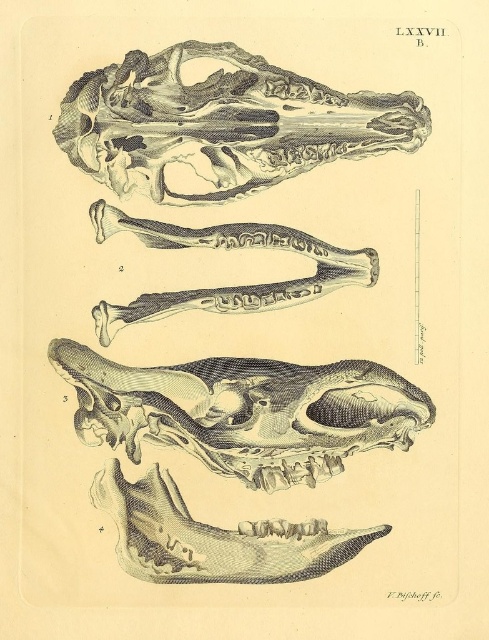
Is etched bone skull at upper center thinner than gray textured skull at center?

Correct, etched bone skull at upper center's width is less than gray textured skull at center's.

Is point (120, 140) positioned before point (274, 538)?

Yes, point (120, 140) is in front of point (274, 538).

Locate an element on the screen. This screenshot has width=489, height=640. etched bone skull at upper center is located at coordinates (222, 124).

Can you confirm if gray textured skull at center is positioned to the left of gray etched skull at upper center?

Correct, you'll find gray textured skull at center to the left of gray etched skull at upper center.

What do you see at coordinates (244, 412) in the screenshot? This screenshot has height=640, width=489. I see `gray textured skull at center` at bounding box center [244, 412].

I want to click on gray textured skull at center, so click(244, 412).

Looking at this image, does etched bone skull at upper center appear on the left side of gray etched skull at upper center?

No, etched bone skull at upper center is not to the left of gray etched skull at upper center.

The height and width of the screenshot is (640, 489). What are the coordinates of `etched bone skull at upper center` in the screenshot? It's located at (222, 124).

Which is behind, point (358, 145) or point (267, 80)?

The point (358, 145) is more distant.

This screenshot has height=640, width=489. I want to click on etched bone skull at upper center, so click(x=222, y=124).